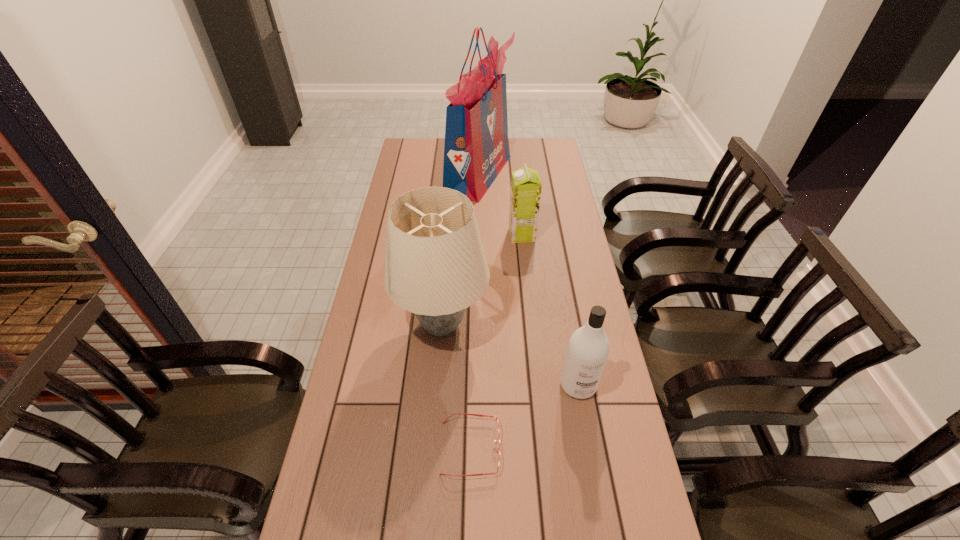
Where is `vacant position at the far left corner of the desktop`? vacant position at the far left corner of the desktop is located at coordinates [x=402, y=161].

The height and width of the screenshot is (540, 960). I want to click on unoccupied area between the soya milk and the tallest object, so click(x=500, y=205).

Where is `free space between the rightmost object and the grocery bag`? free space between the rightmost object and the grocery bag is located at coordinates (528, 280).

Find the location of `vacant point located between the second farthest object and the tallest object`. vacant point located between the second farthest object and the tallest object is located at coordinates (500, 205).

I want to click on vacant space that is in between the soya milk and the nearest object, so click(x=496, y=341).

What are the coordinates of `free space between the tallest object and the rightmost object` in the screenshot? It's located at (528, 280).

Identify the location of free spot between the second farthest object and the nearest object. This screenshot has height=540, width=960. (496, 341).

Find the location of a particular element. free spot between the spectacles and the farthest object is located at coordinates (474, 311).

The height and width of the screenshot is (540, 960). I want to click on object that is the third closest to the farthest object, so click(x=588, y=348).

Point out which object is positioned as the third nearest to the spectacles. Please provide its 2D coordinates. Your answer should be formatted as a tuple, i.e. [(x, y)], where the tuple contains the x and y coordinates of a point satisfying the conditions above.

[(526, 186)]